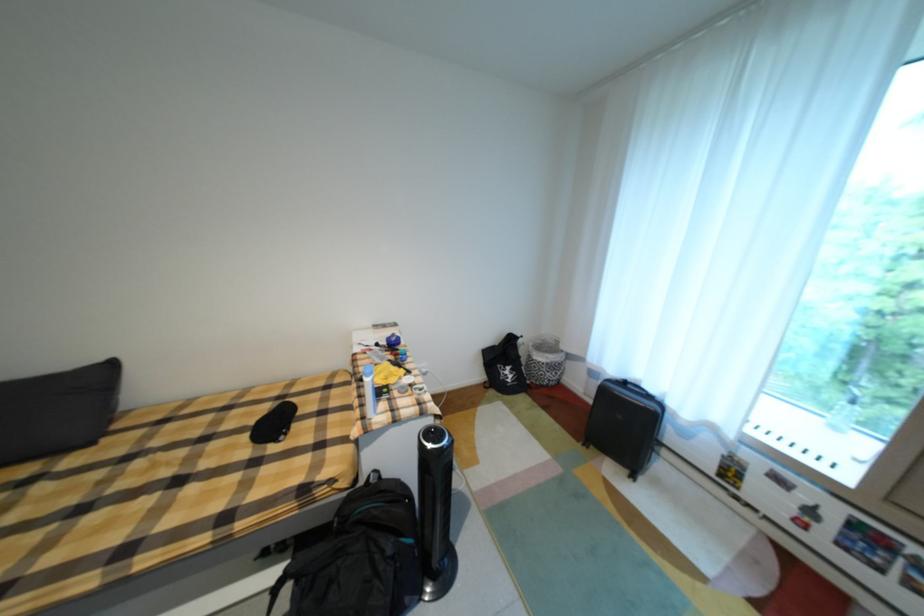
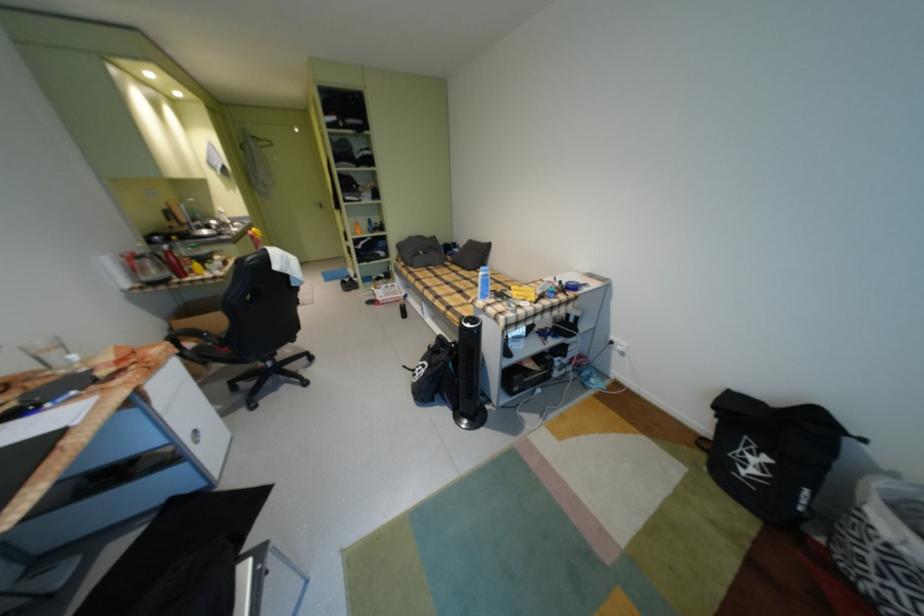
The point at (x=304, y=496) is marked in the first image. Where is the corresponding point in the second image?

(470, 318)